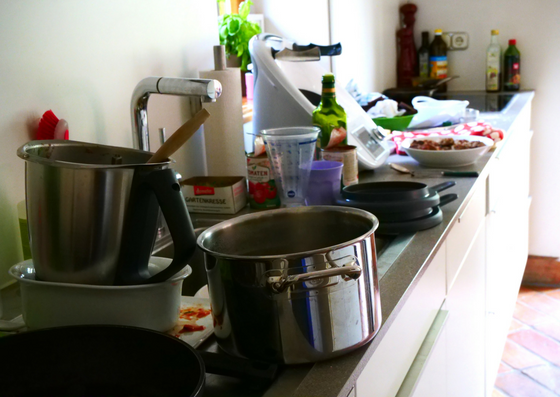
Locate an element on the screen. The image size is (560, 397). drawer is located at coordinates (406, 339), (464, 244), (505, 173).